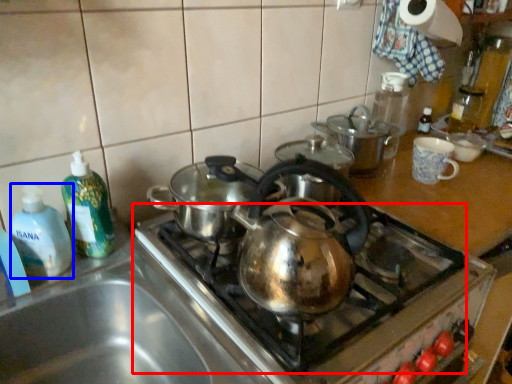
Question: Which of the following is the farthest to the observer, gas stove (highlighted by a red box) or bottle (highlighted by a blue box)?

Choices:
 (A) gas stove
 (B) bottle

Answer: (B)